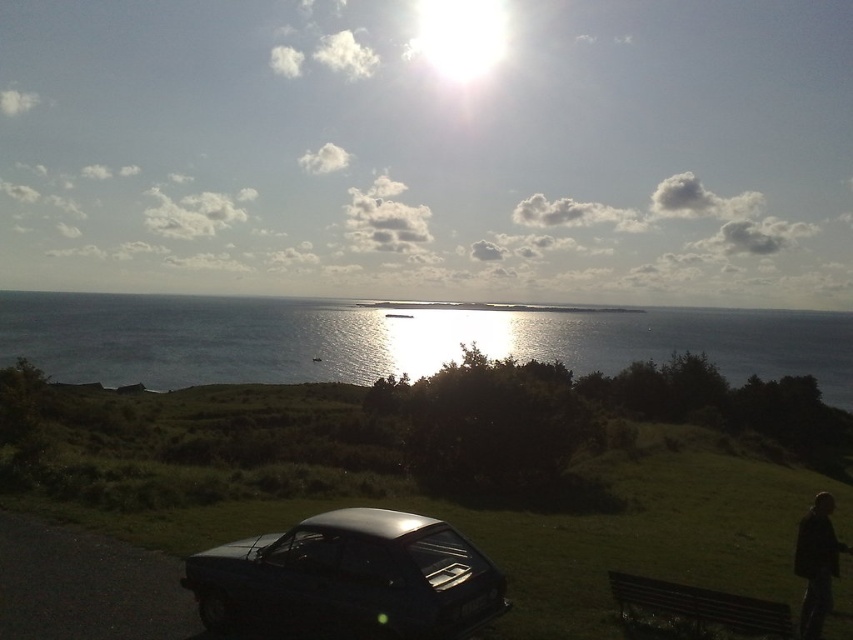
Question: From the image, what is the correct spatial relationship of blue water at center in relation to shiny black car at lower center?

Choices:
 (A) right
 (B) left

Answer: (A)

Question: Which point appears closest to the camera in this image?

Choices:
 (A) (815, 604)
 (B) (639, 584)
 (C) (361, 436)
 (D) (225, 344)

Answer: (B)

Question: Which object appears farthest from the camera in this image?

Choices:
 (A) blue water at center
 (B) shiny black car at lower center

Answer: (A)

Question: Does shiny metallic car at center have a lesser width compared to shiny black car at lower center?

Choices:
 (A) no
 (B) yes

Answer: (A)

Question: Which point is closer to the camera?

Choices:
 (A) shiny black car at lower center
 (B) dark fabric jacket at lower right
 (C) shiny metallic car at center
 (D) blue water at center

Answer: (A)

Question: In this image, where is shiny metallic car at center located relative to blue water at center?

Choices:
 (A) right
 (B) left

Answer: (B)